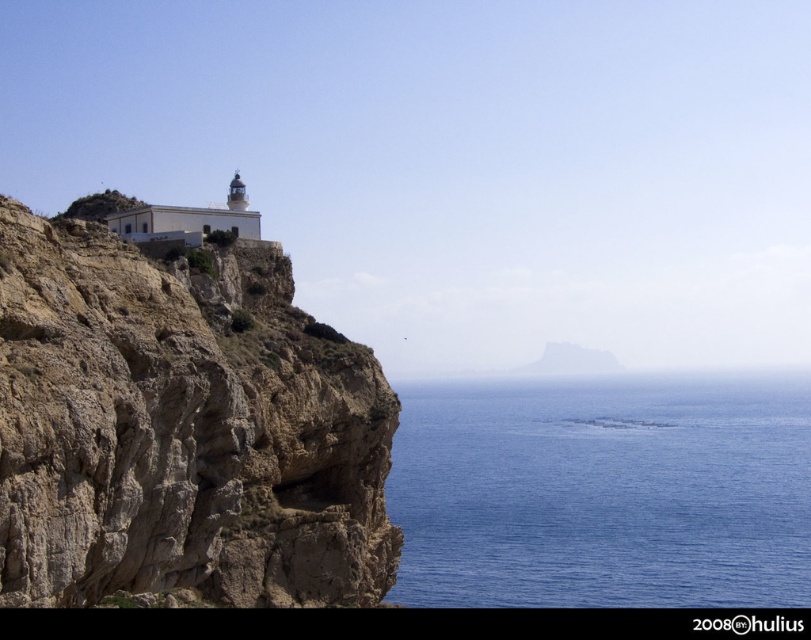
You are a bird soaring above the coastal landscape. You see the brown rough rock at upper left and the blue water at lower right. Which object is closer to the horizon?

The blue water at lower right is closer to the horizon because it is taller than the brown rough rock at upper left, meaning it extends further into the distance.

You are a photographer planning to capture the entire scene in one shot. The brown rough rock at upper left and the blue water at lower right are both in your frame. Considering their sizes, which object will appear smaller in your photo?

The brown rough rock at upper left will appear smaller in the photo because its width is less than that of the blue water at lower right.

You are a painter planning to sketch the coastal landscape. You want to ensure the brown rough rock at upper left and the blue water at lower right are proportionally accurate. Which object should you draw first to maintain the correct size relationship?

The brown rough rock at upper left should be drawn first because it is smaller in size compared to the blue water at lower right, allowing you to establish the scale before adding larger elements.